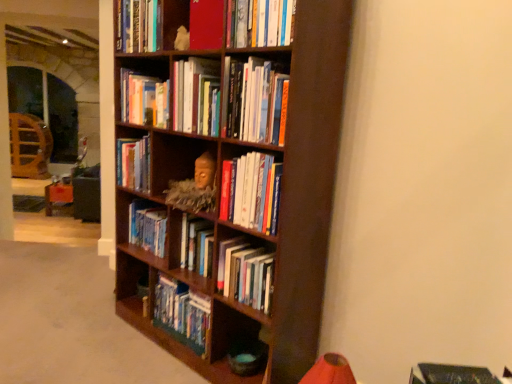
What do you see at coordinates (206, 24) in the screenshot?
I see `matte red book at upper center, which is counted as the 9th book, starting from the bottom` at bounding box center [206, 24].

You are a GUI agent. You are given a task and a screenshot of the screen. Output one action in this format:
    pyautogui.click(x=<x>, y=<y>)
    Task: Click on the dark wood bookcase at center
    
    Given the screenshot: What is the action you would take?
    pyautogui.click(x=251, y=229)

Image resolution: width=512 pixels, height=384 pixels. What do you see at coordinates (251, 229) in the screenshot?
I see `dark wood bookcase at center` at bounding box center [251, 229].

Find the location of `hardcover books at center, arranged as the 6th book when ordered from the bottom`. hardcover books at center, arranged as the 6th book when ordered from the bottom is located at coordinates (196, 96).

Where is `hardcover book at center, the 9th book in the top-to-bottom sequence`? This screenshot has width=512, height=384. hardcover book at center, the 9th book in the top-to-bottom sequence is located at coordinates (451, 374).

Visually, is hardcover book at upper center, acting as the third book starting from the top, positioned to the left or to the right of hardcover books at center, which is the first book in bottom-to-top order?

hardcover book at upper center, acting as the third book starting from the top, is positioned on hardcover books at center, which is the first book in bottom-to-top order,'s right side.

How distant is hardcover book at upper center, the eighth book when ordered from bottom to top, from hardcover books at center, which is the first book in bottom-to-top order?

hardcover book at upper center, the eighth book when ordered from bottom to top, is 1.28 meters away from hardcover books at center, which is the first book in bottom-to-top order.

Is point (252, 24) less distant than point (201, 320)?

Yes.

Is hardcover book at upper center, the eighth book when ordered from bottom to top, spatially inside hardcover books at center, the tenth book from the top, or outside of it?

hardcover book at upper center, the eighth book when ordered from bottom to top, is not inside hardcover books at center, the tenth book from the top, it's outside.

Looking at this image, measure the distance from hardcover books at center, the 7th book ordered from the bottom, to hardcover books at center, which is the eighth book from top to bottom.

hardcover books at center, the 7th book ordered from the bottom, and hardcover books at center, which is the eighth book from top to bottom, are 33.94 inches apart.

From a real-world perspective, is hardcover books at center, the 7th book ordered from the bottom, physically located above or below hardcover books at center, the 3th book positioned from the bottom?

In terms of real-world spatial position, hardcover books at center, the 7th book ordered from the bottom, is above hardcover books at center, the 3th book positioned from the bottom.

From the image's perspective, which object appears higher, hardcover books at center, the 7th book ordered from the bottom, or hardcover books at center, the 3th book positioned from the bottom?

hardcover books at center, the 7th book ordered from the bottom, appears higher in the image.

Could you tell me if hardcover books at center, arranged as the 6th book when ordered from the bottom, is facing hardcover book at upper center, arranged as the tenth book when ordered from the bottom?

No, hardcover books at center, arranged as the 6th book when ordered from the bottom, does not turn towards hardcover book at upper center, arranged as the tenth book when ordered from the bottom.

Which object is closer to the camera taking this photo, hardcover books at center, the fifth book positioned from the top, or hardcover book at upper center, the first book viewed from the top?

hardcover books at center, the fifth book positioned from the top, is in front.

Considering the relative positions of hardcover books at center, the fifth book positioned from the top, and hardcover book at upper center, the first book viewed from the top, in the image provided, is hardcover books at center, the fifth book positioned from the top, to the left of hardcover book at upper center, the first book viewed from the top, from the viewer's perspective?

No.

Which of these two, hardcover books at center, the fifth book positioned from the top, or hardcover book at upper center, the first book viewed from the top, stands taller?

hardcover books at center, the fifth book positioned from the top.

Is hardcover books at center, which is the first book in bottom-to-top order, wider than hardcover books at center, which is the eighth book from top to bottom?

Correct, the width of hardcover books at center, which is the first book in bottom-to-top order, exceeds that of hardcover books at center, which is the eighth book from top to bottom.

In terms of size, does hardcover books at center, which is the first book in bottom-to-top order, appear bigger or smaller than hardcover books at center, the 3th book positioned from the bottom?

Considering their sizes, hardcover books at center, which is the first book in bottom-to-top order, takes up more space than hardcover books at center, the 3th book positioned from the bottom.

Is hardcover books at center, the tenth book from the top, facing away from hardcover books at center, which is the eighth book from top to bottom?

No, hardcover books at center, the tenth book from the top, is not facing the opposite direction of hardcover books at center, which is the eighth book from top to bottom.

Which of these two, hardcover book at upper center, acting as the third book starting from the top, or hardcover books at center, placed as the seventh book when sorted from top to bottom, stands taller?

hardcover books at center, placed as the seventh book when sorted from top to bottom, is taller.

Considering their positions, is hardcover book at upper center, the eighth book when ordered from bottom to top, located in front of or behind hardcover books at center, placed as the seventh book when sorted from top to bottom?

hardcover book at upper center, the eighth book when ordered from bottom to top, is in front of hardcover books at center, placed as the seventh book when sorted from top to bottom.

Measure the distance from hardcover book at upper center, the eighth book when ordered from bottom to top, to hardcover books at center, placed as the seventh book when sorted from top to bottom.

hardcover book at upper center, the eighth book when ordered from bottom to top, and hardcover books at center, placed as the seventh book when sorted from top to bottom, are 20.98 inches apart from each other.

From the image's perspective, would you say hardcover book at upper center, the eighth book when ordered from bottom to top, is shown under hardcover books at center, placed as the seventh book when sorted from top to bottom?

No.

From a real-world perspective, which object stands above the other?

hardcover books at upper center, the fifth book ordered from the bottom, from a real-world perspective.

In terms of height, does hardcover books at center, placed as the seventh book when sorted from top to bottom, look taller or shorter compared to hardcover books at upper center, arranged as the 6th book when viewed from the top?

hardcover books at center, placed as the seventh book when sorted from top to bottom, is taller than hardcover books at upper center, arranged as the 6th book when viewed from the top.

Is hardcover books at center, placed as the seventh book when sorted from top to bottom, situated inside hardcover books at upper center, arranged as the 6th book when viewed from the top, or outside?

hardcover books at center, placed as the seventh book when sorted from top to bottom, exists outside the volume of hardcover books at upper center, arranged as the 6th book when viewed from the top.

Which is more to the right, hardcover books at center, placed as the fourth book when sorted from bottom to top, or hardcover books at upper center, the fifth book ordered from the bottom?

From the viewer's perspective, hardcover books at upper center, the fifth book ordered from the bottom, appears more on the right side.

Where is `the 1st book in front of the hardcover book at upper center, the first book viewed from the top, counting from the anchor's position`? This screenshot has width=512, height=384. the 1st book in front of the hardcover book at upper center, the first book viewed from the top, counting from the anchor's position is located at coordinates (206, 24).

Does matte red book at upper center, which is counted as the 9th book, starting from the bottom, have a lesser width compared to hardcover book at upper center, the first book viewed from the top?

No, matte red book at upper center, which is counted as the 9th book, starting from the bottom, is not thinner than hardcover book at upper center, the first book viewed from the top.

Does matte red book at upper center, the second book positioned from the top, appear on the right side of hardcover book at upper center, the first book viewed from the top?

Yes, matte red book at upper center, the second book positioned from the top, is to the right of hardcover book at upper center, the first book viewed from the top.

From the image's perspective, which one is positioned lower, matte red book at upper center, the second book positioned from the top, or hardcover book at upper center, arranged as the tenth book when ordered from the bottom?

From the image's view, matte red book at upper center, the second book positioned from the top, is below.

From a real-world perspective, count 7th books upward from the hardcover books at center, which is the first book in bottom-to-top order, and point to it. Please provide its 2D coordinates.

[(260, 23)]

Identify the location of book that is the 5th one when counting forward from the hardcover books at center, the fourth book viewed from the top. (246, 274).

Considering their positions, is white plush toy at upper center positioned further to matte red book at upper center, the second book positioned from the top, than hardcover book at upper center, acting as the third book starting from the top?

hardcover book at upper center, acting as the third book starting from the top, lies further to matte red book at upper center, the second book positioned from the top, than the other object.

Which object lies further to the anchor point white plush toy at upper center, hardcover books at upper center, the fifth book ordered from the bottom, or hardcover book at upper center, the first book viewed from the top?

hardcover books at upper center, the fifth book ordered from the bottom, is further to white plush toy at upper center.

Based on their spatial positions, is hardcover book at center, the 9th book in the top-to-bottom sequence, or hardcover books at center, the fifth book positioned from the top, further from hardcover book at upper center, acting as the third book starting from the top?

Based on the image, hardcover book at center, the 9th book in the top-to-bottom sequence, appears to be further to hardcover book at upper center, acting as the third book starting from the top.

Considering their positions, is hardcover books at upper center, the fifth book ordered from the bottom, positioned further to hardcover books at center, which is the first book in bottom-to-top order, than matte red book at upper center, which is counted as the 9th book, starting from the bottom?

The object further to hardcover books at center, which is the first book in bottom-to-top order, is matte red book at upper center, which is counted as the 9th book, starting from the bottom.

Which object lies nearer to the anchor point hardcover book at upper center, the eighth book when ordered from bottom to top, white plush toy at upper center or hardcover books at center, the fifth book positioned from the top?

hardcover books at center, the fifth book positioned from the top, is closer to hardcover book at upper center, the eighth book when ordered from bottom to top.

Estimate the real-world distances between objects in this image. Which object is closer to hardcover books at center, arranged as the 6th book when ordered from the bottom, white plush toy at upper center or hardcover books at center, the 7th book ordered from the bottom?

white plush toy at upper center.

Looking at the image, which one is located closer to hardcover book at upper center, acting as the third book starting from the top, hardcover books at center, which is the eighth book from top to bottom, or hardcover books at center, placed as the fourth book when sorted from bottom to top?

Based on the image, hardcover books at center, placed as the fourth book when sorted from bottom to top, appears to be nearer to hardcover book at upper center, acting as the third book starting from the top.

From the image, which object appears to be nearer to hardcover books at center, the 7th book ordered from the bottom, hardcover book at center, the 9th book in the top-to-bottom sequence, or hardcover books at center, arranged as the 6th book when ordered from the bottom?

hardcover books at center, arranged as the 6th book when ordered from the bottom, lies closer to hardcover books at center, the 7th book ordered from the bottom, than the other object.

This screenshot has width=512, height=384. What are the coordinates of `toy between matte red book at upper center, the second book positioned from the top, and hardcover books at center, the tenth book from the top, in the up-down direction` in the screenshot? It's located at (182, 39).

This screenshot has width=512, height=384. I want to click on book between dark wood bookcase at center and hardcover books at center, the 3th book positioned from the bottom, in the up-down direction, so click(x=251, y=192).

Where is `book between hardcover books at center, arranged as the 6th book when ordered from the bottom, and dark wood bookcase at center vertically`? book between hardcover books at center, arranged as the 6th book when ordered from the bottom, and dark wood bookcase at center vertically is located at coordinates (255, 101).

The height and width of the screenshot is (384, 512). I want to click on toy between hardcover book at upper center, arranged as the tenth book when ordered from the bottom, and hardcover books at center, which is the first book in bottom-to-top order, in the up-down direction, so click(182, 39).